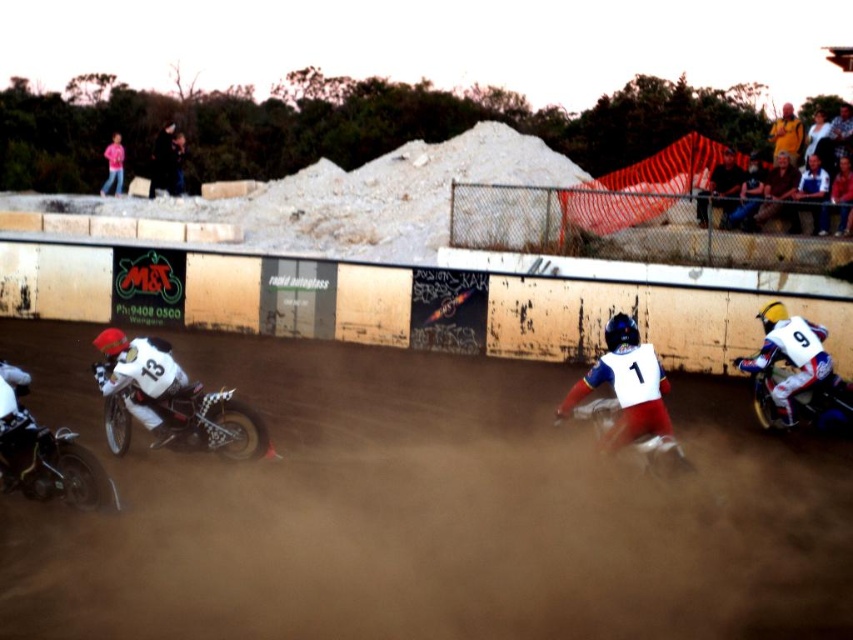
Who is positioned more to the left, white glossy motorbike at center or yellow jersey at upper right?

Positioned to the left is white glossy motorbike at center.

Does point (850, 417) come behind point (769, 132)?

No, (850, 417) is closer to viewer.

Is point (753, 387) behind point (811, 138)?

No, (753, 387) is in front of (811, 138).

Where is `white glossy motorbike at center`? The image size is (853, 640). white glossy motorbike at center is located at coordinates tap(824, 404).

How far apart are brushed metal motorcycle at left and white glossy motorbike at center?

They are 5.96 meters apart.

Does brushed metal motorcycle at left lie in front of white glossy motorbike at center?

Yes, it is.

Between point (227, 451) and point (764, 392), which one is positioned behind?

Positioned behind is point (764, 392).

This screenshot has height=640, width=853. What are the coordinates of `brushed metal motorcycle at left` in the screenshot? It's located at (213, 422).

Is yellow jersey at upper right to the left of pink fabric at upper left from the viewer's perspective?

No, yellow jersey at upper right is not to the left of pink fabric at upper left.

Is yellow jersey at upper right closer to camera compared to pink fabric at upper left?

Yes, it is in front of pink fabric at upper left.

Is point (769, 138) farther from viewer compared to point (106, 156)?

That is True.

Where is `yellow jersey at upper right`? The height and width of the screenshot is (640, 853). yellow jersey at upper right is located at coordinates (798, 131).